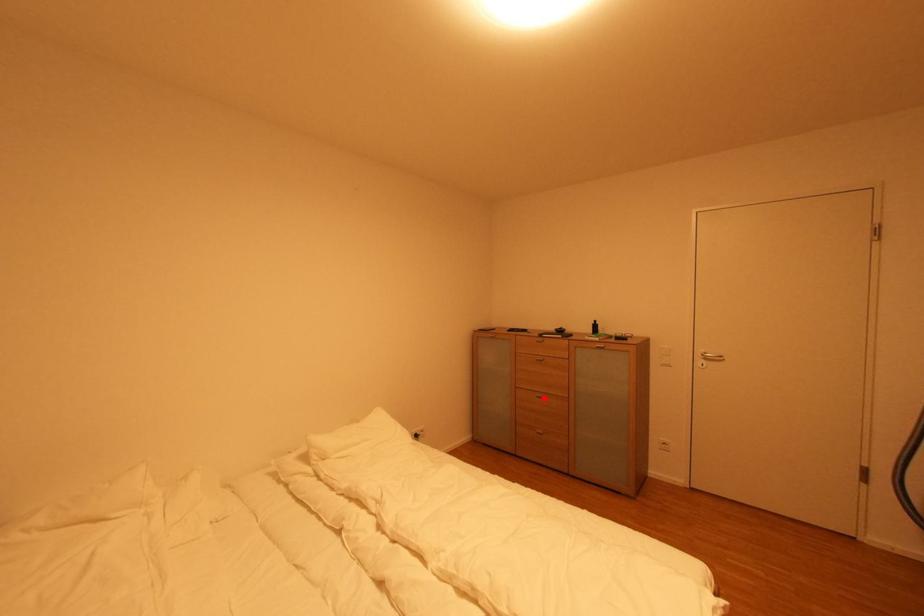
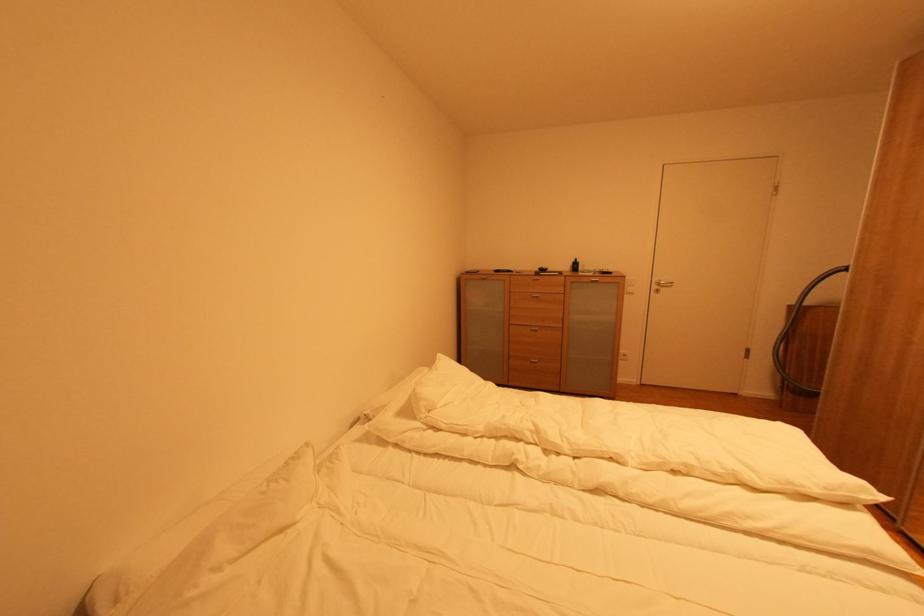
Locate, in the second image, the point that corresponds to the highlighted location in the first image.

(539, 331)